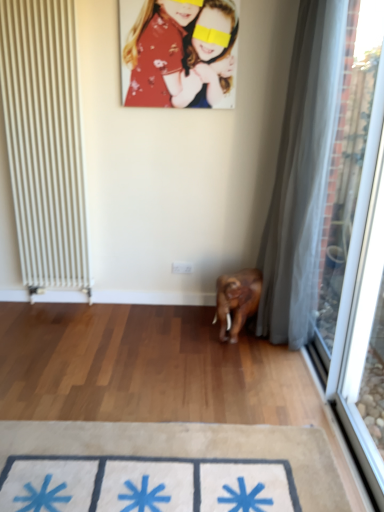
The width and height of the screenshot is (384, 512). What do you see at coordinates (45, 142) in the screenshot?
I see `white metal radiator at left` at bounding box center [45, 142].

This screenshot has width=384, height=512. What are the coordinates of `floral fabric portrait at upper center` in the screenshot? It's located at (182, 54).

Measure the distance between point (x=349, y=155) and camera.

Point (x=349, y=155) is 12.24 feet away from camera.

In order to click on beige fabric doormat at lower center in this screenshot , I will do `click(166, 468)`.

From the image's perspective, does transparent fabric at right appear lower than white metal radiator at left?

Correct, transparent fabric at right appears lower than white metal radiator at left in the image.

Is transparent fabric at right to the right of white metal radiator at left from the viewer's perspective?

Indeed, transparent fabric at right is positioned on the right side of white metal radiator at left.

Identify the location of radiator above the transparent fabric at right (from a real-world perspective). The height and width of the screenshot is (512, 384). (45, 142).

Choose the correct answer: Is transparent fabric at right inside white metal radiator at left or outside it?

transparent fabric at right is not inside white metal radiator at left, it's outside.

Based on the photo, is floral fabric portrait at upper center inside the boundaries of beige fabric doormat at lower center, or outside?

floral fabric portrait at upper center cannot be found inside beige fabric doormat at lower center.

Considering the sizes of objects floral fabric portrait at upper center and beige fabric doormat at lower center in the image provided, who is bigger, floral fabric portrait at upper center or beige fabric doormat at lower center?

With larger size is beige fabric doormat at lower center.

Is floral fabric portrait at upper center at the left side of beige fabric doormat at lower center?

Incorrect, floral fabric portrait at upper center is not on the left side of beige fabric doormat at lower center.

Is floral fabric portrait at upper center behind beige fabric doormat at lower center?

That is True.

Is beige fabric doormat at lower center not near white metal radiator at left?

Yes, beige fabric doormat at lower center and white metal radiator at left are quite far apart.

Consider the image. What's the angular difference between beige fabric doormat at lower center and white metal radiator at left's facing directions?

180 degrees.

Is beige fabric doormat at lower center positioned beyond the bounds of white metal radiator at left?

beige fabric doormat at lower center is positioned outside white metal radiator at left.

The image size is (384, 512). In order to click on doormat in front of the white metal radiator at left in this screenshot , I will do `click(166, 468)`.

Is beige fabric doormat at lower center shorter than transparent fabric at right?

Indeed, beige fabric doormat at lower center has a lesser height compared to transparent fabric at right.

Is beige fabric doormat at lower center turned away from transparent fabric at right?

beige fabric doormat at lower center does not have its back to transparent fabric at right.

Is the surface of beige fabric doormat at lower center in direct contact with transparent fabric at right?

beige fabric doormat at lower center is not next to transparent fabric at right, and they're not touching.

Which is farther, (121, 489) or (323, 81)?

Positioned behind is point (323, 81).

From a real-world perspective, does beige fabric doormat at lower center sit lower than white sheer curtain at right?

Indeed, from a real-world perspective, beige fabric doormat at lower center is positioned beneath white sheer curtain at right.

Could you tell me if beige fabric doormat at lower center is turned towards white sheer curtain at right?

No, beige fabric doormat at lower center is not turned towards white sheer curtain at right.

Considering the relative sizes of beige fabric doormat at lower center and white sheer curtain at right in the image provided, is beige fabric doormat at lower center smaller than white sheer curtain at right?

Yes, beige fabric doormat at lower center is smaller than white sheer curtain at right.

Is transparent fabric at right at the back of floral fabric portrait at upper center?

floral fabric portrait at upper center is not turned away from transparent fabric at right.

Can we say floral fabric portrait at upper center lies outside transparent fabric at right?

Indeed, floral fabric portrait at upper center is completely outside transparent fabric at right.

Considering the sizes of objects floral fabric portrait at upper center and transparent fabric at right in the image provided, who is taller, floral fabric portrait at upper center or transparent fabric at right?

With more height is transparent fabric at right.

Image resolution: width=384 pixels, height=512 pixels. What are the coordinates of `window screen in front of the floral fabric portrait at upper center` in the screenshot? It's located at (349, 181).

Based on the photo, from the image's perspective, is white metal radiator at left above or below beige fabric doormat at lower center?

Clearly, from the image's perspective, white metal radiator at left is above beige fabric doormat at lower center.

Which of these two, white metal radiator at left or beige fabric doormat at lower center, stands taller?

white metal radiator at left.

Is white metal radiator at left spatially inside beige fabric doormat at lower center, or outside of it?

white metal radiator at left cannot be found inside beige fabric doormat at lower center.

Which of these two, white metal radiator at left or beige fabric doormat at lower center, is bigger?

white metal radiator at left.

In the image, there is a white metal radiator at left. Where is `window screen below it (from the image's perspective)`? The image size is (384, 512). window screen below it (from the image's perspective) is located at coordinates (349, 181).

Identify the location of doormat on the left of floral fabric portrait at upper center. Image resolution: width=384 pixels, height=512 pixels. (166, 468).

Looking at this image, estimate the real-world distances between objects in this image. Which object is further from white metal radiator at left, transparent fabric at right or beige fabric doormat at lower center?

transparent fabric at right is positioned further to the anchor white metal radiator at left.

From the image, which object appears to be farther from white metal radiator at left, white sheer curtain at right or transparent fabric at right?

transparent fabric at right is positioned further to the anchor white metal radiator at left.

When comparing their distances from beige fabric doormat at lower center, does white metal radiator at left or white sheer curtain at right seem further?

white metal radiator at left is further to beige fabric doormat at lower center.

When comparing their distances from white sheer curtain at right, does transparent fabric at right or beige fabric doormat at lower center seem further?

The object further to white sheer curtain at right is beige fabric doormat at lower center.

Based on the photo, from the image, which object appears to be farther from white sheer curtain at right, transparent fabric at right or white metal radiator at left?

Among the two, white metal radiator at left is located further to white sheer curtain at right.

Considering their positions, is transparent fabric at right positioned closer to floral fabric portrait at upper center than white sheer curtain at right?

Based on the image, white sheer curtain at right appears to be nearer to floral fabric portrait at upper center.

Considering their positions, is beige fabric doormat at lower center positioned further to white sheer curtain at right than white metal radiator at left?

Based on the image, white metal radiator at left appears to be further to white sheer curtain at right.

Estimate the real-world distances between objects in this image. Which object is further from white metal radiator at left, white sheer curtain at right or floral fabric portrait at upper center?

Among the two, white sheer curtain at right is located further to white metal radiator at left.

Find the location of a particular element. window screen between floral fabric portrait at upper center and beige fabric doormat at lower center in the up-down direction is located at coordinates (349, 181).

The height and width of the screenshot is (512, 384). I want to click on curtain between white metal radiator at left and transparent fabric at right in the horizontal direction, so click(302, 176).

At what (x,y) coordinates should I click in order to perform the action: click on window screen between white sheer curtain at right and beige fabric doormat at lower center from top to bottom. Please return your answer as a coordinate pair (x, y). This screenshot has height=512, width=384. Looking at the image, I should click on (349, 181).

Where is `curtain between floral fabric portrait at upper center and transparent fabric at right from top to bottom`? curtain between floral fabric portrait at upper center and transparent fabric at right from top to bottom is located at coordinates (302, 176).